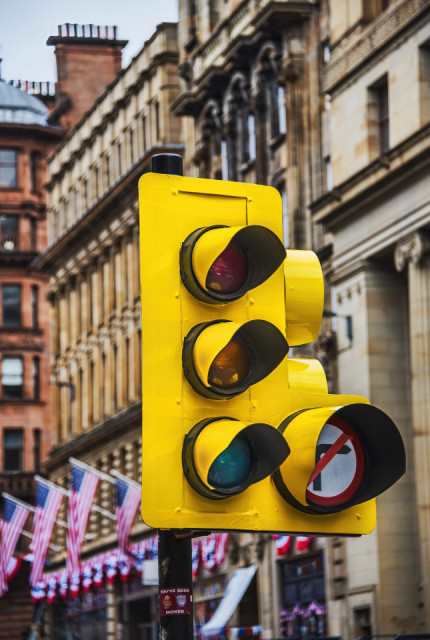
The width and height of the screenshot is (430, 640). I want to click on window, so click(x=300, y=589).